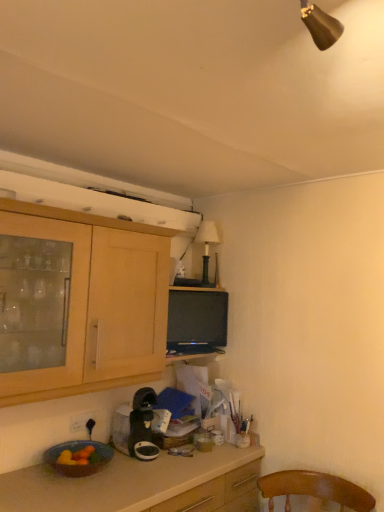
Locate an element on the screen. This screenshot has width=384, height=512. free point above matte black tv at center (from a real-world perspective) is located at coordinates (202, 290).